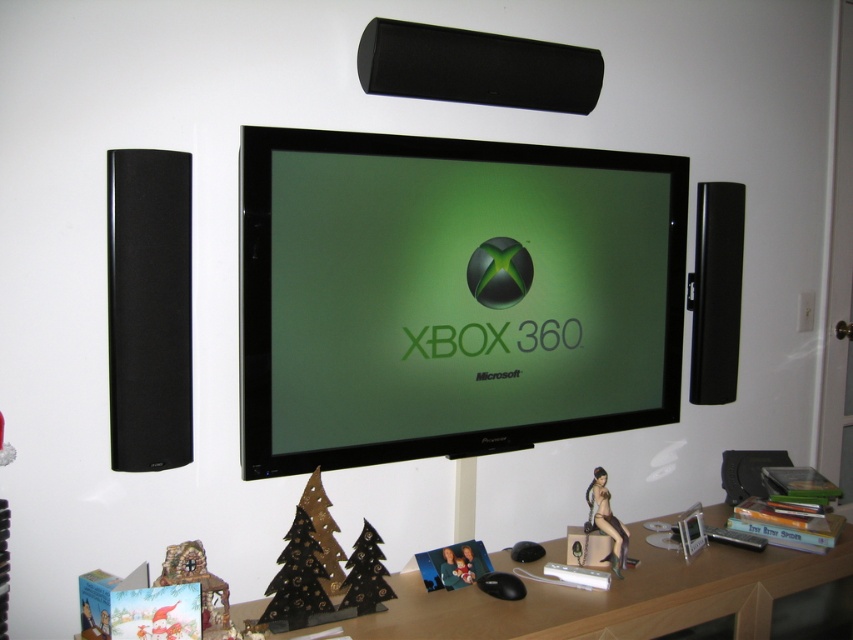
Does matte black monitor at center have a smaller size compared to satin nude figurine at lower right?

No, matte black monitor at center is not smaller than satin nude figurine at lower right.

Is point (445, 451) more distant than point (608, 522)?

No, (445, 451) is in front of (608, 522).

Where is `matte black monitor at center`? matte black monitor at center is located at coordinates (450, 296).

Is matte black monitor at center to the right of wooden at lower center from the viewer's perspective?

No, matte black monitor at center is not to the right of wooden at lower center.

Can you confirm if matte black monitor at center is positioned below wooden at lower center?

Incorrect, matte black monitor at center is not positioned below wooden at lower center.

Which is behind, point (572, 250) or point (675, 609)?

Positioned behind is point (572, 250).

Find the location of a particular element. Image resolution: width=853 pixels, height=640 pixels. matte black monitor at center is located at coordinates (450, 296).

Does point (619, 618) lie in front of point (595, 502)?

Yes, it is in front of point (595, 502).

Can you confirm if wooden at lower center is taller than satin nude figurine at lower right?

In fact, wooden at lower center may be shorter than satin nude figurine at lower right.

Measure the distance between point (416, 586) and camera.

They are 5.60 feet apart.

Locate an element on the screen. This screenshot has height=640, width=853. wooden at lower center is located at coordinates (618, 596).